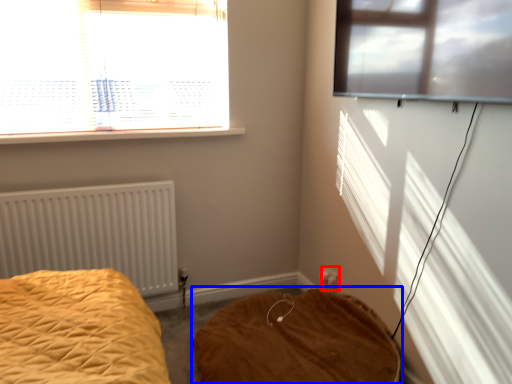
Question: Which of the following is the closest to the observer, electric outlet (highlighted by a red box) or mattress (highlighted by a blue box)?

Choices:
 (A) electric outlet
 (B) mattress

Answer: (B)